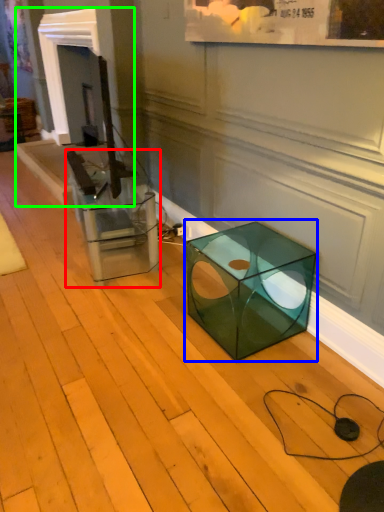
Question: Based on their relative distances, which object is farther from glass box (highlighted by a red box)? Choose from table (highlighted by a blue box) and fireplace (highlighted by a green box).

Choices:
 (A) table
 (B) fireplace

Answer: (B)